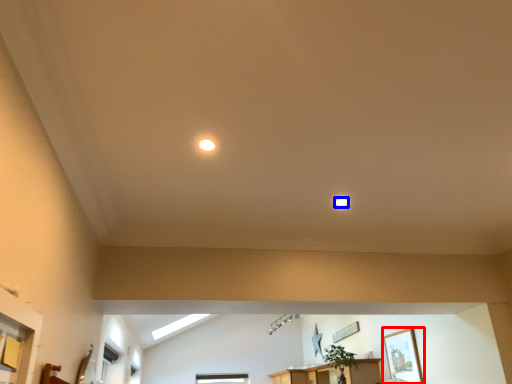
Question: Which object is closer to the camera taking this photo, picture frame (highlighted by a red box) or lighting (highlighted by a blue box)?

Choices:
 (A) picture frame
 (B) lighting

Answer: (B)